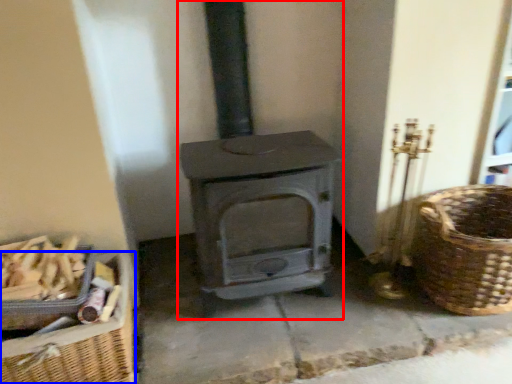
Question: Which point is closer to the camera, wood burning stove (highlighted by a red box) or basket (highlighted by a blue box)?

Choices:
 (A) wood burning stove
 (B) basket

Answer: (A)